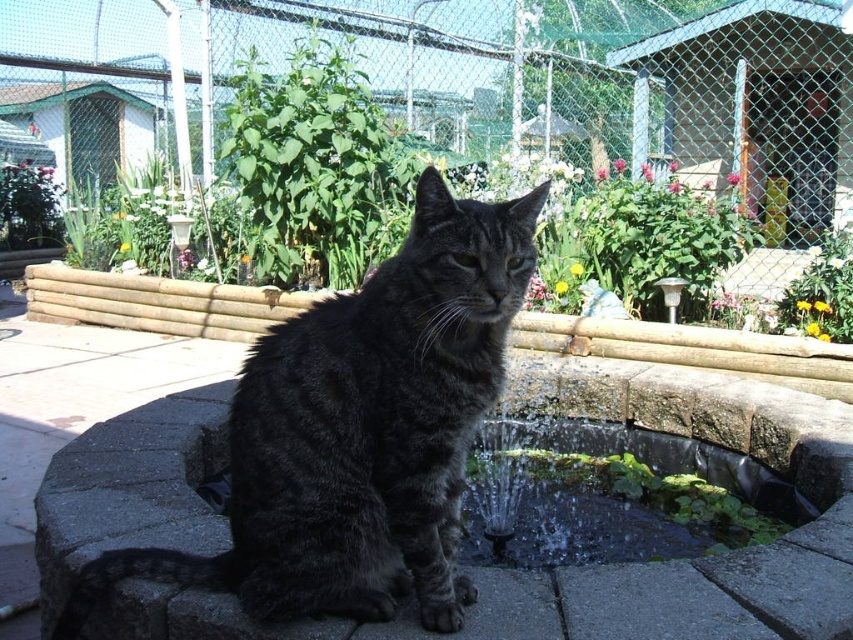
Consider the image. You are standing in the garden and see two points marked in the image. The first point is at coordinate point (254, 525) and the second is at point (850, 474). Which point is closer to you?

Point (254, 525) is in front of point (850, 474), so the first point is closer to you.

Based on the scene description, can you determine which object takes up more area in the image between the dark gray fur cat at center and the smooth stone fountain at center?

The smooth stone fountain at center takes up more area than the dark gray fur cat at center because the dark gray fur cat at center occupies less space than smooth stone fountain at center.

Looking at this image, based on the scene description, can you determine the position of the dark gray fur cat at center relative to the smooth stone fountain at center?

The dark gray fur cat at center is to the left of the smooth stone fountain at center.